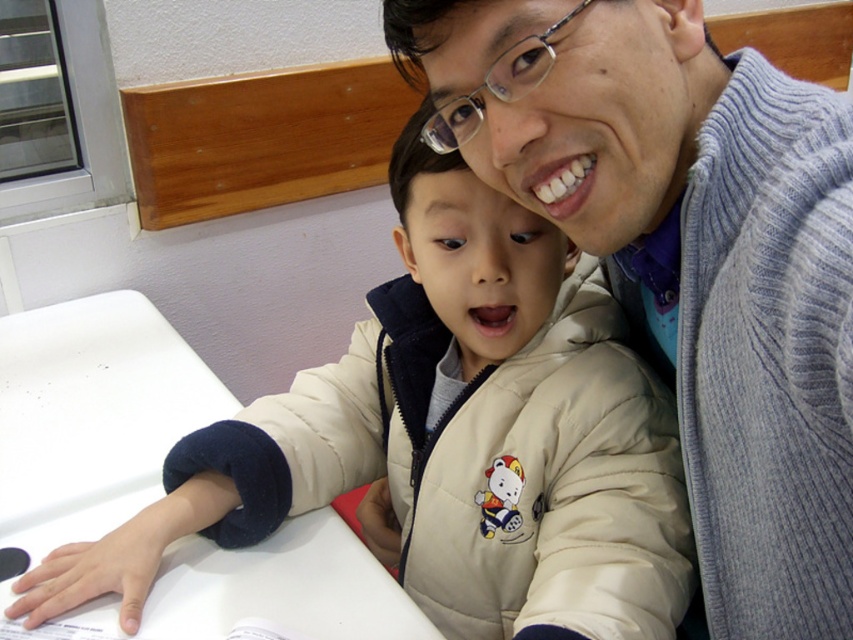
Consider the image. You are a photographer setting up a shot of the scene. You need to place a small reflector to the right of the gray knit sweater at upper right and to the left of the white matte table at lower left. Is this possible given their positions?

The gray knit sweater at upper right is to the right of the white matte table at lower left, so placing a reflector between them to the right of the sweater and to the left of the table would not be possible since the sweater is already positioned to the right of the table.

Based on the scene description, where is the gray knit sweater at upper right located in terms of its position relative to the white table and the window with horizontal blinds?

The gray knit sweater at upper right is located at point (688, 257) in 2D coordinates, which places it near the upper right corner of the scene, above the white table and to the right of the window with horizontal blinds.

From the picture: You are organizing a small event in the room shown. You have a beige quilted jacket at center and a white matte table at lower left. Which object takes up more space in the room?

The white matte table at lower left takes up more space in the room than the beige quilted jacket at center because the beige quilted jacket at center occupies less space than white matte table at lower left.